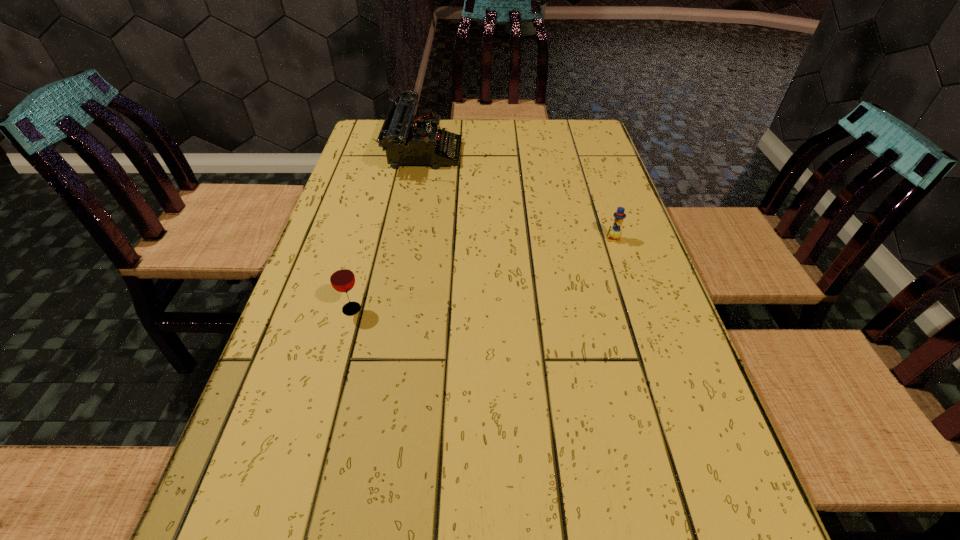
The image size is (960, 540). What are the coordinates of `typewriter` in the screenshot? It's located at (408, 139).

Identify the location of the nearest object. The width and height of the screenshot is (960, 540). (342, 278).

This screenshot has width=960, height=540. In order to click on the second shortest object in this screenshot , I will do `click(342, 278)`.

The image size is (960, 540). In order to click on the shortest object in this screenshot , I will do `click(615, 232)`.

Find the location of a particular element. This screenshot has width=960, height=540. the second farthest object is located at coordinates (x=615, y=232).

Where is `free space located 0.290m on the keyboard of the typewriter`? free space located 0.290m on the keyboard of the typewriter is located at coordinates (554, 153).

You are a GUI agent. You are given a task and a screenshot of the screen. Output one action in this format:
    pyautogui.click(x=<x>, y=<y>)
    Task: Click on the free space located on the back of the glass
    This screenshot has height=540, width=960.
    Given the screenshot: What is the action you would take?
    pyautogui.click(x=376, y=220)

Locate an element on the screen. vacant space located on the face of the rightmost object, where the monocle is placed is located at coordinates (626, 279).

Where is `object located in the far edge section of the desktop`? Image resolution: width=960 pixels, height=540 pixels. object located in the far edge section of the desktop is located at coordinates (408, 139).

The height and width of the screenshot is (540, 960). I want to click on typewriter present at the left edge, so click(x=408, y=139).